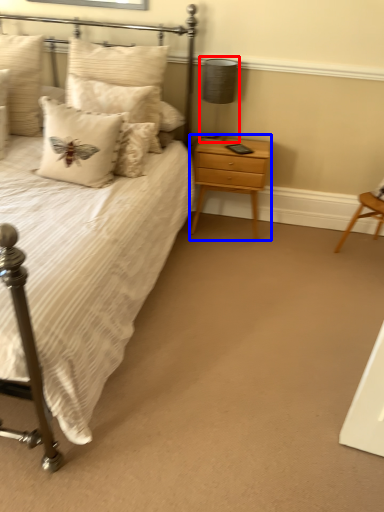
Question: Which object is closer to the camera taking this photo, table lamp (highlighted by a red box) or nightstand (highlighted by a blue box)?

Choices:
 (A) table lamp
 (B) nightstand

Answer: (A)